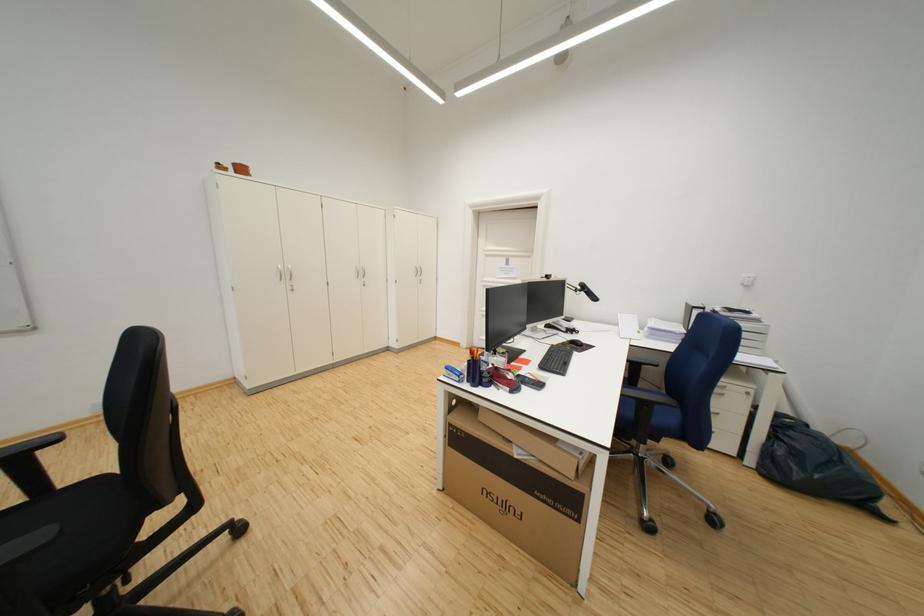
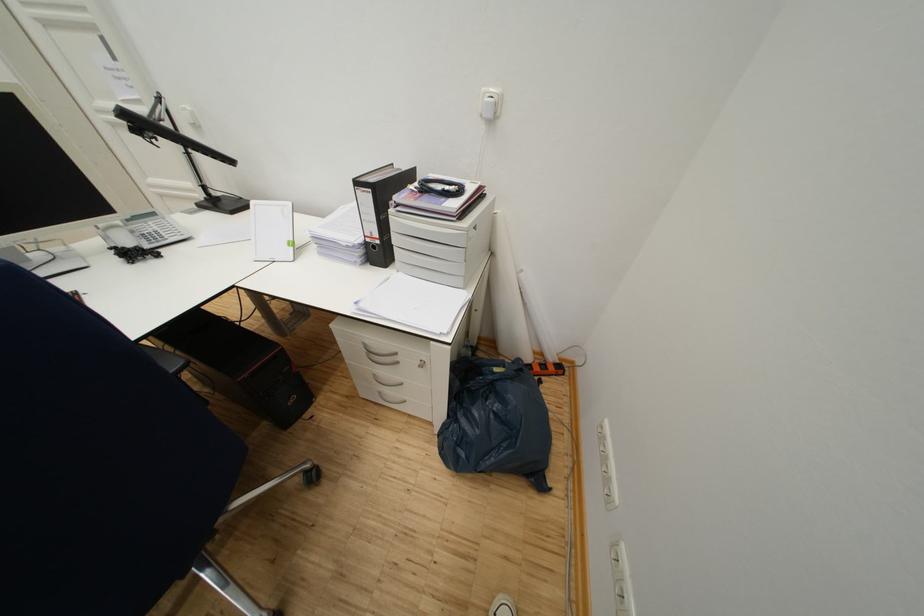
Where in the second image is the point corresponding to (792,440) from the first image?

(468, 423)